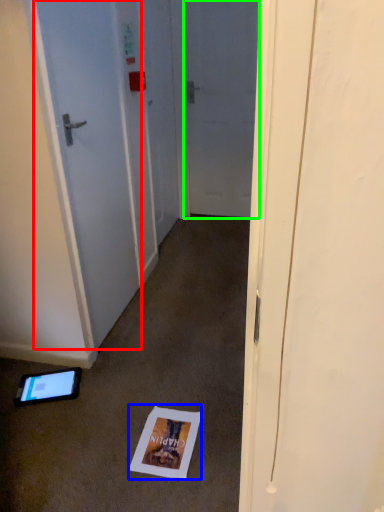
Question: Based on their relative distances, which object is farther from door (highlighted by a red box)? Choose from postcard (highlighted by a blue box) and door (highlighted by a green box).

Choices:
 (A) postcard
 (B) door

Answer: (B)